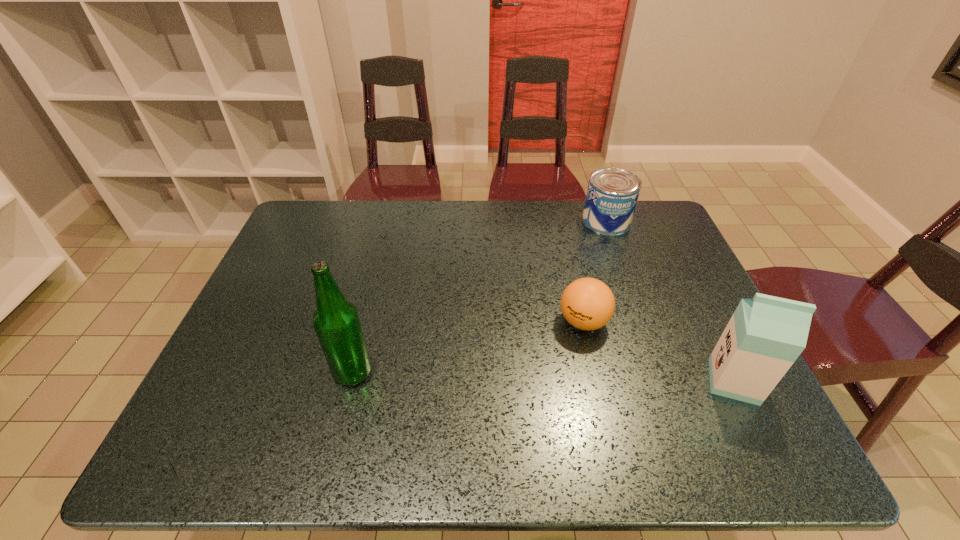
The width and height of the screenshot is (960, 540). I want to click on blank space located on the label of the beer bottle, so click(x=252, y=372).

Where is `free spot located on the back of the rightmost object`? free spot located on the back of the rightmost object is located at coordinates (681, 273).

Where is `vacant space located on the front label of the can`? The width and height of the screenshot is (960, 540). vacant space located on the front label of the can is located at coordinates (576, 303).

Where is `free space located on the front label of the can`? free space located on the front label of the can is located at coordinates (578, 298).

Identify the location of free spot located on the front label of the can. (586, 278).

This screenshot has width=960, height=540. Find the location of `vacant space located on the side with brand of the shortest object`. vacant space located on the side with brand of the shortest object is located at coordinates (488, 386).

Identify the location of vacant space located on the side with brand of the shortest object. This screenshot has width=960, height=540. (540, 351).

Find the location of `vacant area situated 0.130m on the side with brand of the shortest object`. vacant area situated 0.130m on the side with brand of the shortest object is located at coordinates (x=527, y=359).

I want to click on object present at the far edge, so click(x=612, y=194).

Identify the location of beer bottle present at the near edge. (336, 321).